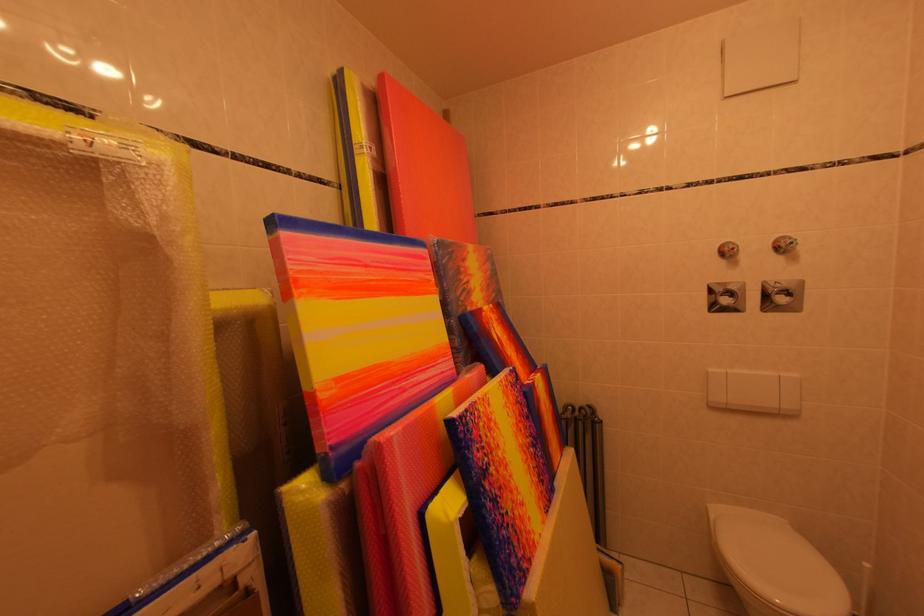
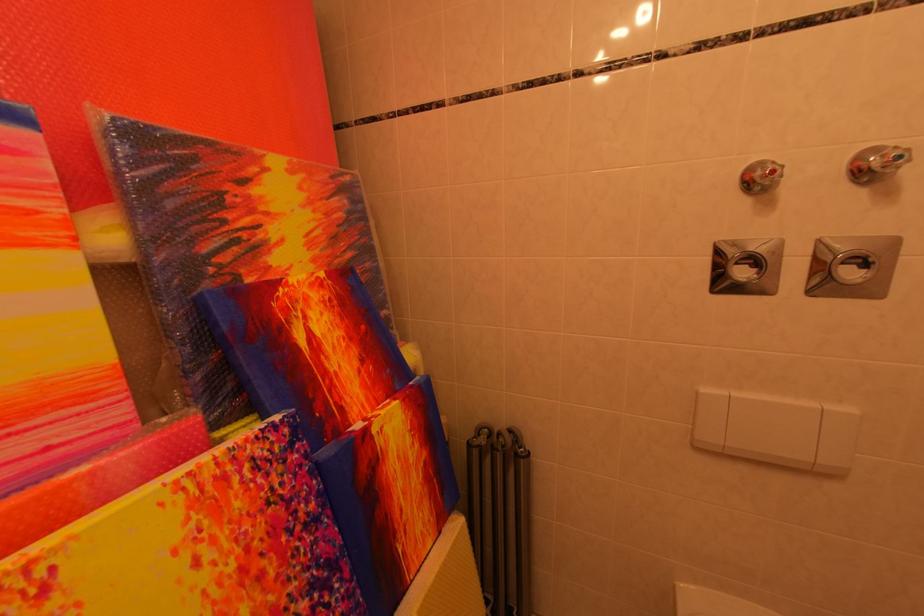
Where in the second image is the point corresponding to (x=799, y=246) from the first image?

(907, 161)